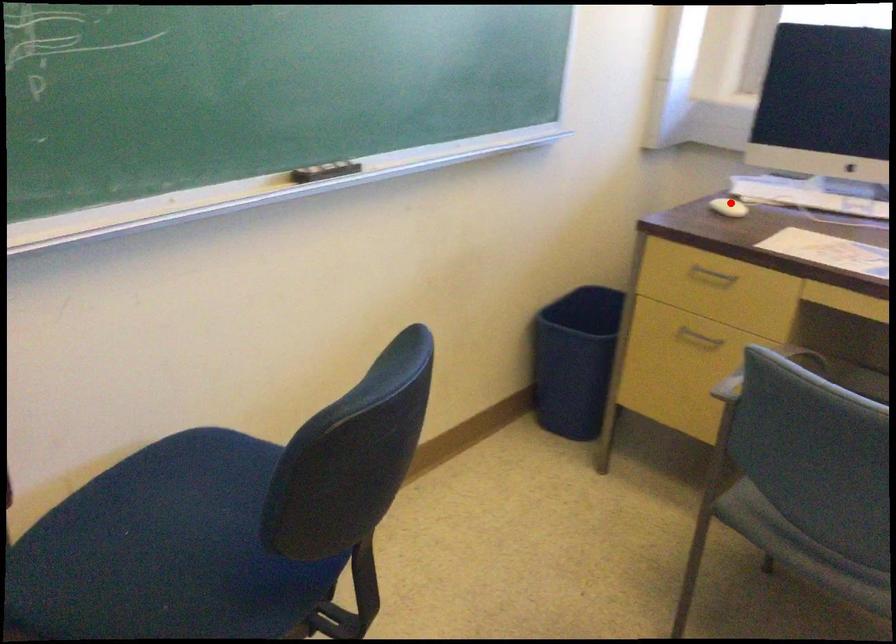
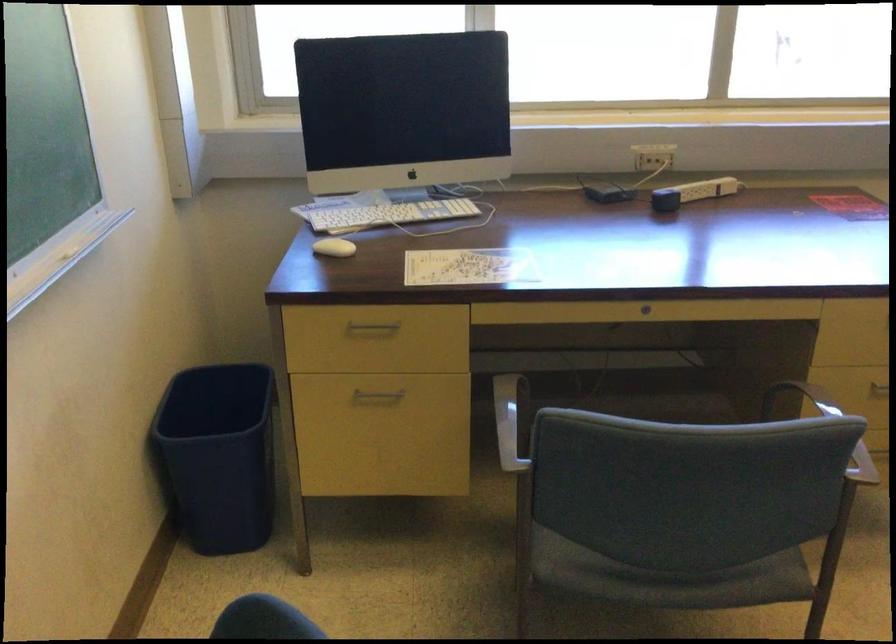
Where in the second image is the point corresponding to the highlighted location from the first image?

(333, 247)